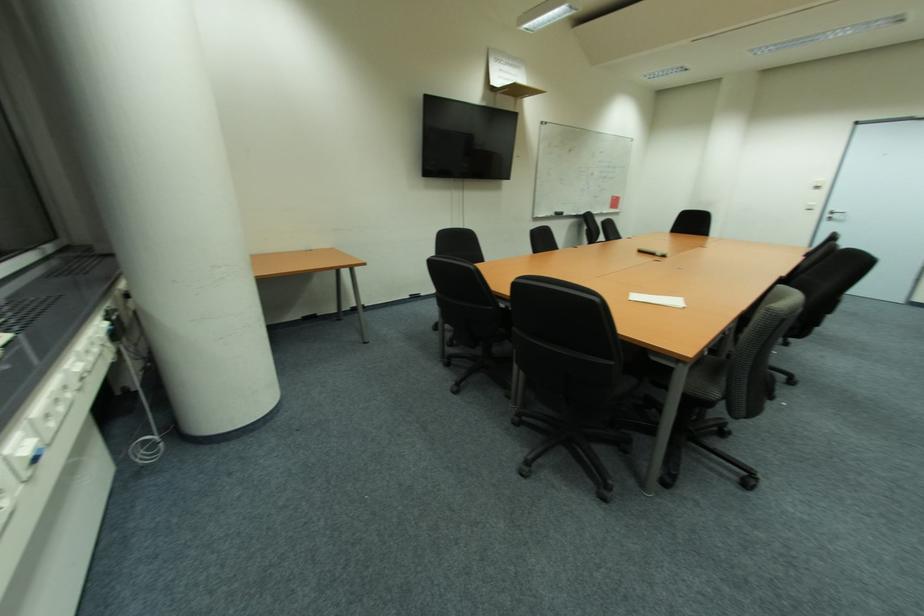
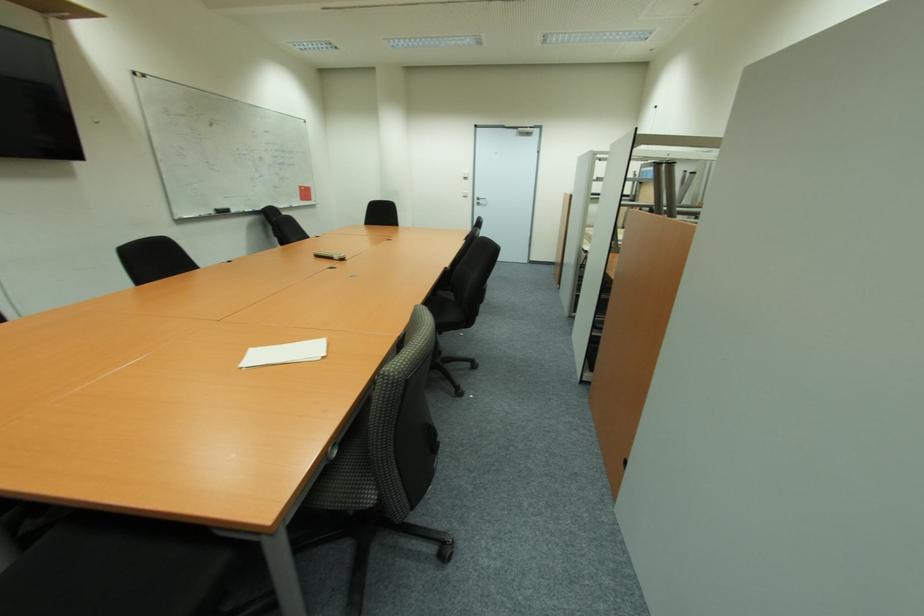
Question: The camera is either moving clockwise (left) or counter-clockwise (right) around the object. The first image is from the beginning of the video and the second image is from the end. Is the camera moving left or right when shooting the video?

Choices:
 (A) Left
 (B) Right

Answer: (A)